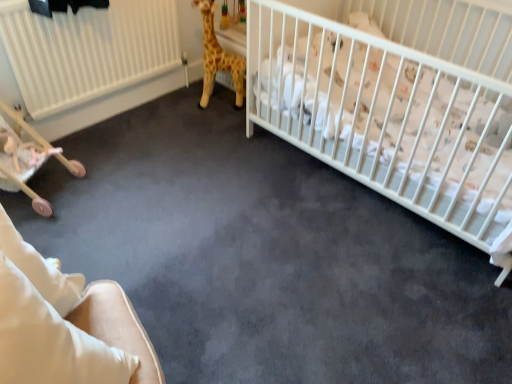
Question: Is yellow plush giraffe at upper center turned away from white matte crib at upper right?

Choices:
 (A) yes
 (B) no

Answer: (B)

Question: From a real-world perspective, is yellow plush giraffe at upper center below white matte crib at upper right?

Choices:
 (A) yes
 (B) no

Answer: (A)

Question: Is yellow plush giraffe at upper center aimed at white matte crib at upper right?

Choices:
 (A) yes
 (B) no

Answer: (B)

Question: Does yellow plush giraffe at upper center appear on the right side of white matte crib at upper right?

Choices:
 (A) yes
 (B) no

Answer: (B)

Question: Is yellow plush giraffe at upper center shorter than white matte crib at upper right?

Choices:
 (A) yes
 (B) no

Answer: (A)

Question: Considering the positions of wooden baby carriage at lower left and yellow plush giraffe at upper center in the image, is wooden baby carriage at lower left bigger or smaller than yellow plush giraffe at upper center?

Choices:
 (A) big
 (B) small

Answer: (A)

Question: From a real-world perspective, is wooden baby carriage at lower left positioned above or below yellow plush giraffe at upper center?

Choices:
 (A) above
 (B) below

Answer: (B)

Question: From the image's perspective, is wooden baby carriage at lower left above or below yellow plush giraffe at upper center?

Choices:
 (A) below
 (B) above

Answer: (A)

Question: From their relative heights in the image, would you say wooden baby carriage at lower left is taller or shorter than yellow plush giraffe at upper center?

Choices:
 (A) tall
 (B) short

Answer: (B)

Question: Would you say beige fabric rocking chair at lower left is inside or outside pink plush toy at lower left?

Choices:
 (A) outside
 (B) inside

Answer: (A)

Question: Considering their positions, is beige fabric rocking chair at lower left located in front of or behind pink plush toy at lower left?

Choices:
 (A) front
 (B) behind

Answer: (A)

Question: Based on their positions, is beige fabric rocking chair at lower left located to the left or right of pink plush toy at lower left?

Choices:
 (A) right
 (B) left

Answer: (A)

Question: Does point (55, 263) appear closer or farther from the camera than point (53, 152)?

Choices:
 (A) closer
 (B) farther

Answer: (A)

Question: Choose the correct answer: Is white matte crib at upper right inside yellow plush giraffe at upper center or outside it?

Choices:
 (A) outside
 (B) inside

Answer: (A)

Question: Is white matte crib at upper right to the left or to the right of yellow plush giraffe at upper center in the image?

Choices:
 (A) right
 (B) left

Answer: (A)